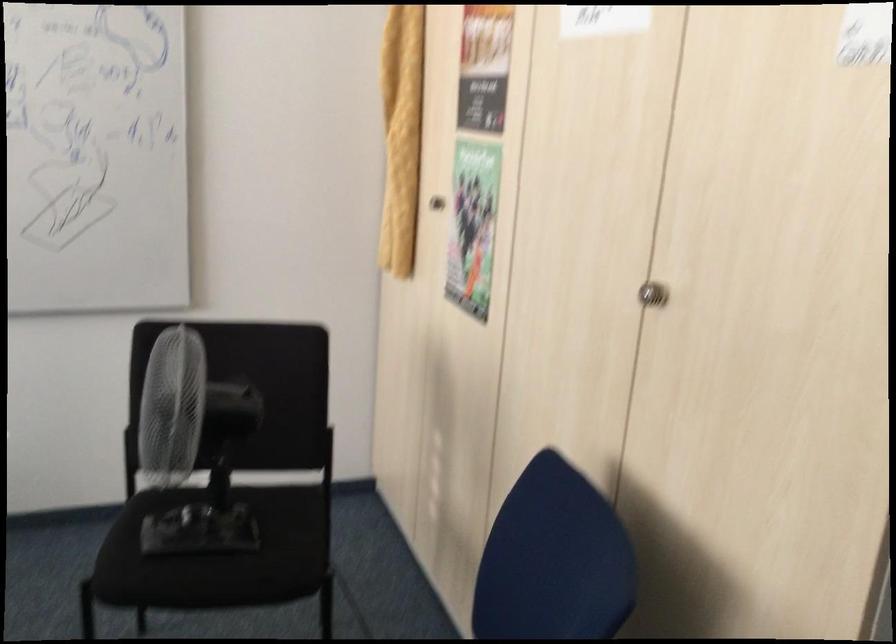
Find where to push the fan control buttons. Please return your answer as a coordinate pair (x, y).

(188, 536)